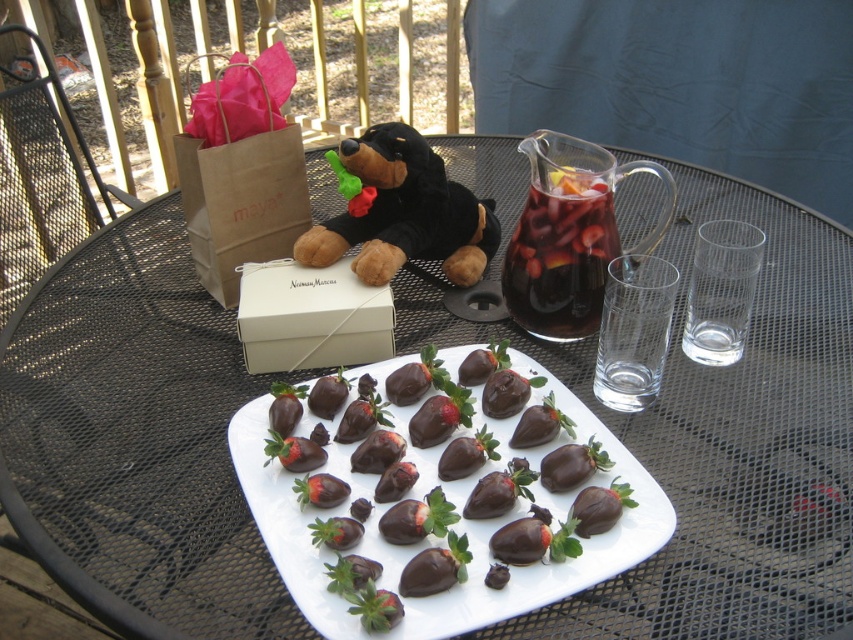
You are setting up a table for a children party and want to place a small gift box between the black plush bear at center and the dark glass pitcher at upper center. The gift box is 2 inches wide. Is there enough space between them to fit the gift box?

The distance between the black plush bear at center and the dark glass pitcher at upper center is 4.82 inches. Since the gift box is 2 inches wide, there is enough space between them to fit the gift box.